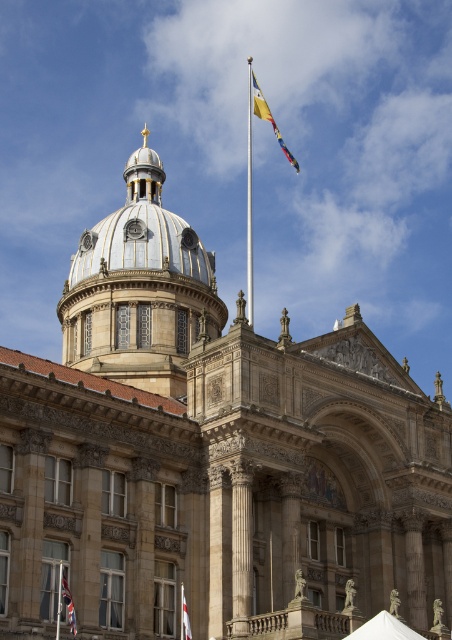
Who is taller, multicolored fabric flag at upper center or red fabric flag at center?

With more height is multicolored fabric flag at upper center.

This screenshot has height=640, width=452. Find the location of `multicolored fabric flag at upper center`. multicolored fabric flag at upper center is located at coordinates (268, 118).

Locate an element on the screen. Image resolution: width=452 pixels, height=640 pixels. multicolored fabric flag at upper center is located at coordinates (268, 118).

Can you confirm if white marble dome at center is smaller than silver metallic pole at upper center?

Actually, white marble dome at center might be larger than silver metallic pole at upper center.

Who is more forward, (102, 289) or (250, 316)?

Point (250, 316)

Image resolution: width=452 pixels, height=640 pixels. I want to click on white marble dome at center, so click(140, 289).

Measure the distance between point (70, 611) and camera.

Point (70, 611) is 144.96 feet away from camera.

Does red fabric flag at center appear on the left side of white fabric flag at lower center?

Indeed, red fabric flag at center is positioned on the left side of white fabric flag at lower center.

Locate an element on the screen. The width and height of the screenshot is (452, 640). red fabric flag at center is located at coordinates (67, 602).

The width and height of the screenshot is (452, 640). I want to click on red fabric flag at center, so click(x=67, y=602).